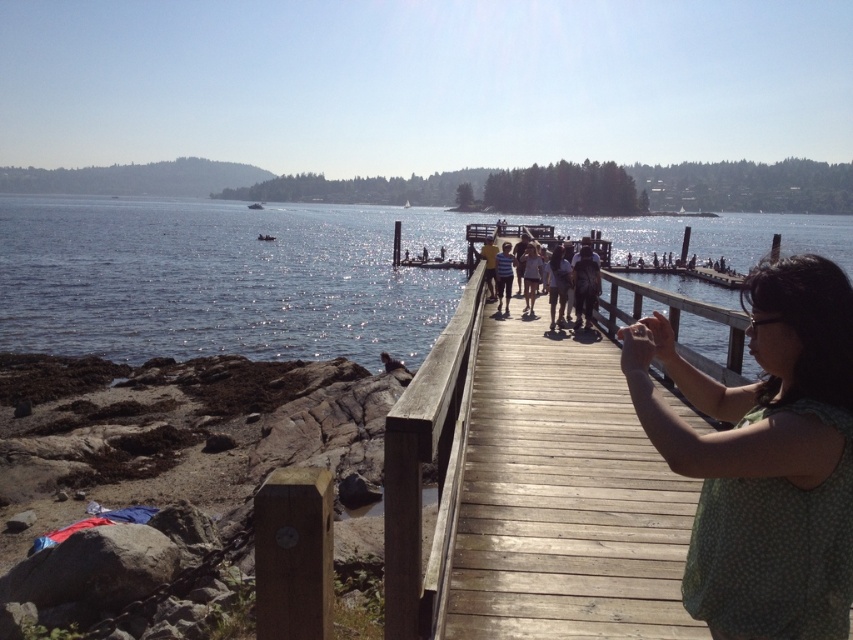
Question: Among these points, which one is farthest from the camera?

Choices:
 (A) (33, 308)
 (B) (506, 308)

Answer: (A)

Question: Which point appears closest to the camera in this image?

Choices:
 (A) (793, 579)
 (B) (508, 300)
 (C) (444, 483)
 (D) (202, 332)

Answer: (A)

Question: Which point is farther from the camera taking this photo?

Choices:
 (A) (49, 304)
 (B) (497, 289)

Answer: (A)

Question: Can you confirm if wooden dock at center is wider than matte yellow shirt at center?

Choices:
 (A) yes
 (B) no

Answer: (A)

Question: Can you confirm if glistening water at center is smaller than matte yellow shirt at center?

Choices:
 (A) no
 (B) yes

Answer: (A)

Question: Does wooden dock at center lie behind striped shirt at center?

Choices:
 (A) no
 (B) yes

Answer: (A)